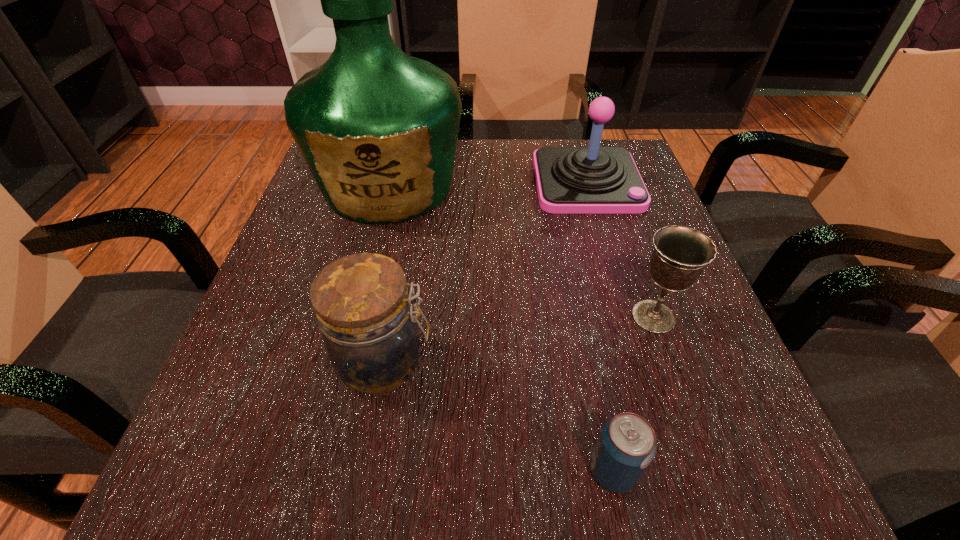
This screenshot has height=540, width=960. Find the location of `vacant space at the far edge of the desktop`. vacant space at the far edge of the desktop is located at coordinates (499, 162).

At what (x,y) coordinates should I click in order to perform the action: click on vacant space at the near edge of the desktop. Please return your answer as a coordinate pair (x, y). Looking at the image, I should click on (586, 450).

Where is `vacant space at the left edge of the desktop`? The image size is (960, 540). vacant space at the left edge of the desktop is located at coordinates (372, 227).

The image size is (960, 540). Identify the location of free space at the right edge of the desktop. (694, 337).

This screenshot has height=540, width=960. Find the location of `free space at the far right corner`. free space at the far right corner is located at coordinates (564, 139).

Locate an element on the screen. The width and height of the screenshot is (960, 540). vacant space that is in between the chalice and the shortest object is located at coordinates (633, 394).

This screenshot has height=540, width=960. Find the location of `free spot between the nearest object and the jar`. free spot between the nearest object and the jar is located at coordinates (498, 416).

Where is `free spot between the chalice and the joystick`? free spot between the chalice and the joystick is located at coordinates (620, 249).

At what (x,y) coordinates should I click in order to perform the action: click on vacant area that lies between the joystick and the tallest object. Please return your answer as a coordinate pair (x, y). Looking at the image, I should click on click(488, 184).

Where is `free space between the tallest object and the joystick`? The image size is (960, 540). free space between the tallest object and the joystick is located at coordinates (488, 184).